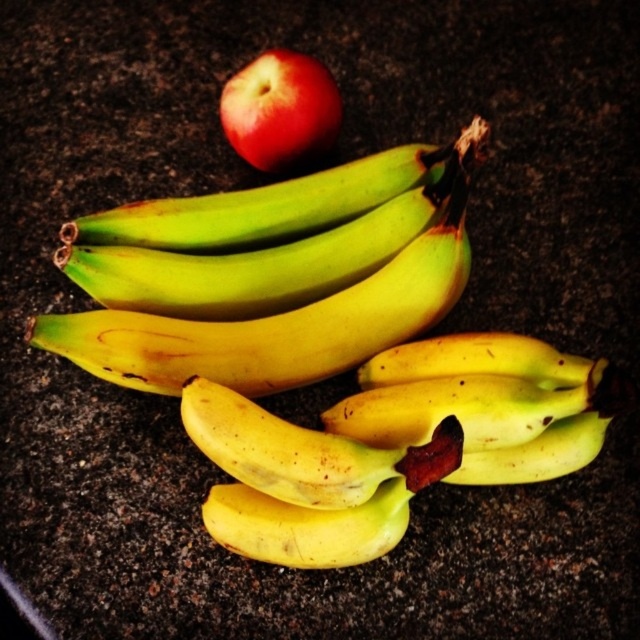
You are arranging fruits on a table for a fruit basket. You have two yellow matte bananas at center and a yellow matte banana at center. Which banana is placed on top of the other?

The yellow matte bananas at center is positioned over yellow matte banana at center, meaning the bananas at center are stacked with the first mentioned on top.

You have a small container that can only fit items with a width of 10 cm or less. You need to place either the yellow matte bananas at center or the glossy red apple at upper center into it. Which fruit should you choose based on their widths?

The glossy red apple at upper center should be chosen because the yellow matte bananas at center have a larger width, exceeding the container limit of 10 cm.

You are arranging fruits on a table and need to place a yellow matte banana at center and a glossy red apple at upper center. According to the image, which fruit is positioned higher?

The glossy red apple at upper center is positioned higher than the yellow matte banana at center.